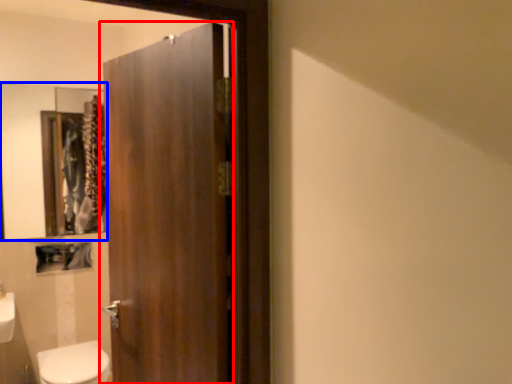
Question: Which of the following is the farthest to the observer, door (highlighted by a red box) or mirror (highlighted by a blue box)?

Choices:
 (A) door
 (B) mirror

Answer: (B)